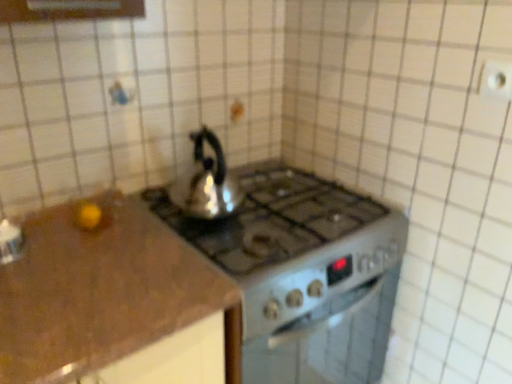
Question: From the image's perspective, is shiny metallic kettle at center over white plastic electric outlet at upper right?

Choices:
 (A) no
 (B) yes

Answer: (A)

Question: Is shiny metallic kettle at center bigger than white plastic electric outlet at upper right?

Choices:
 (A) no
 (B) yes

Answer: (B)

Question: Would you consider shiny metallic kettle at center to be distant from white plastic electric outlet at upper right?

Choices:
 (A) yes
 (B) no

Answer: (B)

Question: Is shiny metallic kettle at center positioned in front of white plastic electric outlet at upper right?

Choices:
 (A) yes
 (B) no

Answer: (B)

Question: Is the depth of shiny metallic kettle at center greater than that of white plastic electric outlet at upper right?

Choices:
 (A) no
 (B) yes

Answer: (B)

Question: Is shiny metallic kettle at center touching white plastic electric outlet at upper right?

Choices:
 (A) yes
 (B) no

Answer: (B)

Question: Could you tell me if white plastic electric outlet at upper right is facing satin silver gas stove at center?

Choices:
 (A) yes
 (B) no

Answer: (B)

Question: Is white plastic electric outlet at upper right positioned far away from satin silver gas stove at center?

Choices:
 (A) no
 (B) yes

Answer: (A)

Question: Can you confirm if white plastic electric outlet at upper right is wider than satin silver gas stove at center?

Choices:
 (A) no
 (B) yes

Answer: (A)

Question: Is white plastic electric outlet at upper right directly adjacent to satin silver gas stove at center?

Choices:
 (A) yes
 (B) no

Answer: (B)

Question: Does white plastic electric outlet at upper right have a greater height compared to satin silver gas stove at center?

Choices:
 (A) no
 (B) yes

Answer: (A)

Question: Is white plastic electric outlet at upper right looking in the opposite direction of satin silver gas stove at center?

Choices:
 (A) no
 (B) yes

Answer: (A)

Question: Does shiny metallic kettle at center have a lesser height compared to satin silver gas stove at center?

Choices:
 (A) yes
 (B) no

Answer: (A)